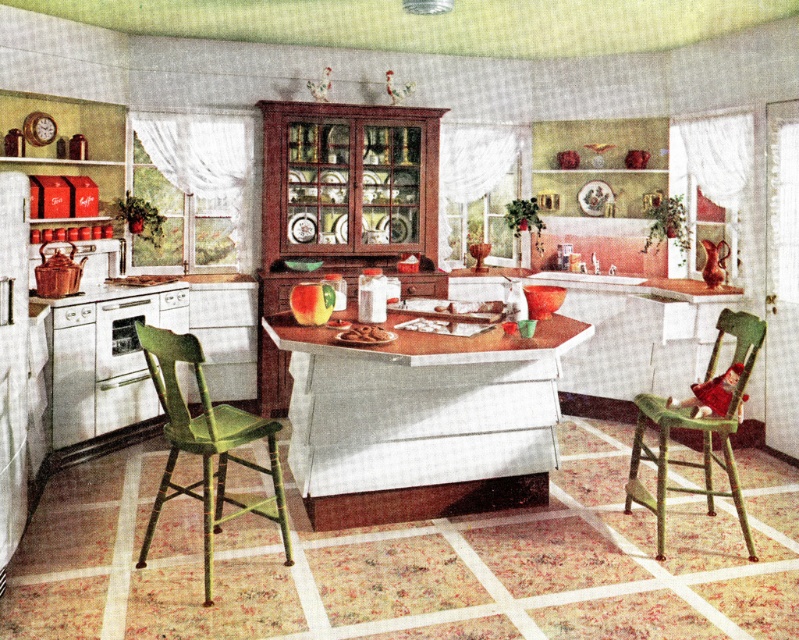
Does wooden table at center have a larger size compared to green wood chair at lower left?

Yes, wooden table at center is bigger than green wood chair at lower left.

Does wooden table at center have a greater width compared to green wood chair at lower left?

Yes.

Is point (479, 440) behind point (217, 449)?

Yes, point (479, 440) is farther from viewer.

The height and width of the screenshot is (640, 799). Find the location of `wooden table at center`. wooden table at center is located at coordinates (420, 419).

Is green wood chair at lower left smaller than green wood chair at lower right?

No.

The image size is (799, 640). Describe the element at coordinates (205, 444) in the screenshot. I see `green wood chair at lower left` at that location.

Where is `green wood chair at lower left`? green wood chair at lower left is located at coordinates [205, 444].

Can you confirm if wooden table at center is smaller than green wood chair at lower right?

Answer: Actually, wooden table at center might be larger than green wood chair at lower right.

Is wooden table at center above green wood chair at lower right?

Yes.

I want to click on wooden table at center, so click(420, 419).

You are a GUI agent. You are given a task and a screenshot of the screen. Output one action in this format:
    pyautogui.click(x=<x>, y=<y>)
    Task: Click on the wooden table at center
    
    Given the screenshot: What is the action you would take?
    pyautogui.click(x=420, y=419)